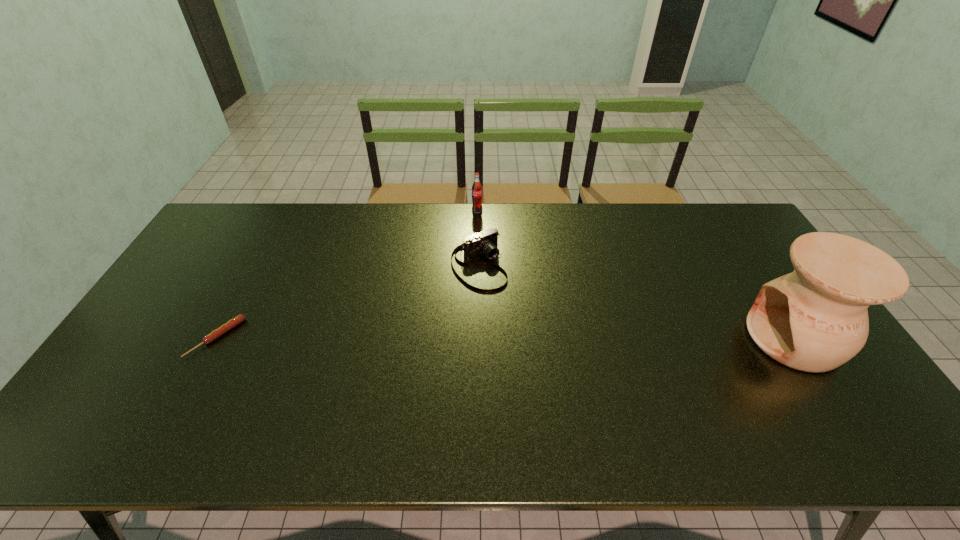
Locate an element on the screen. vacant space located at the open side of the tallest object is located at coordinates (658, 338).

Find the location of a particular element. vacant space situated 0.250m at the open side of the tallest object is located at coordinates (658, 338).

The width and height of the screenshot is (960, 540). Identify the location of blank area located 0.050m on the label of the farthest object. (482, 221).

This screenshot has height=540, width=960. I want to click on free region located 0.340m on the label of the farthest object, so click(x=508, y=274).

Identify the location of blank area located 0.150m on the label of the farthest object. (491, 238).

Find the location of a particular element. The width and height of the screenshot is (960, 540). vacant space located on the front-facing side of the camera is located at coordinates (537, 340).

Locate an element on the screen. Image resolution: width=960 pixels, height=540 pixels. vacant space located on the front-facing side of the camera is located at coordinates (507, 305).

Identify the location of vacant area situated on the front-facing side of the camera. (540, 345).

You are a GUI agent. You are given a task and a screenshot of the screen. Output one action in this format:
    pyautogui.click(x=<x>, y=<y>)
    Task: Click on the soda bottle that is at the far edge
    The width and height of the screenshot is (960, 540).
    Given the screenshot: What is the action you would take?
    pyautogui.click(x=477, y=187)

Locate an element on the screen. camera positioned at the far edge is located at coordinates (486, 242).